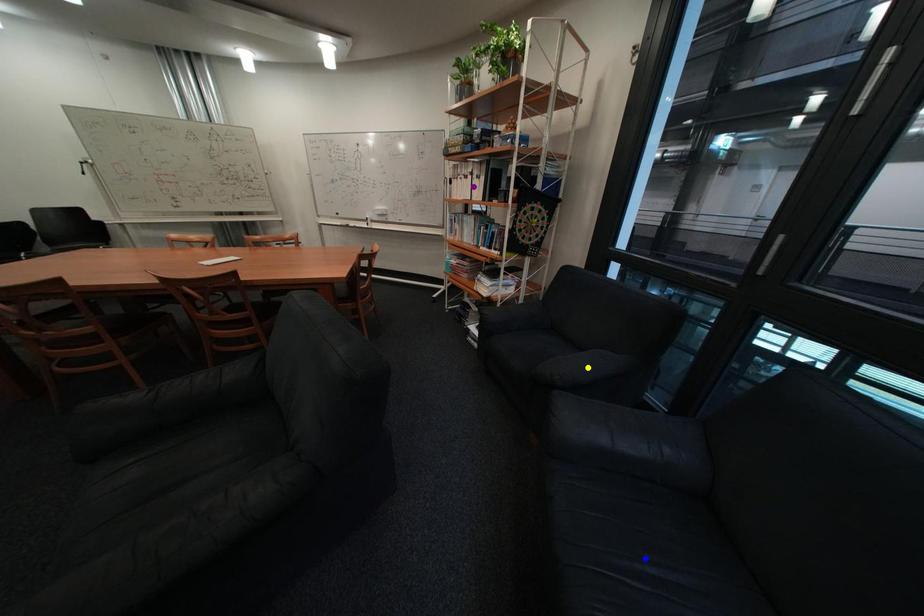
Order these from farthest to nearest:
blue point
purple point
yellow point

purple point, yellow point, blue point